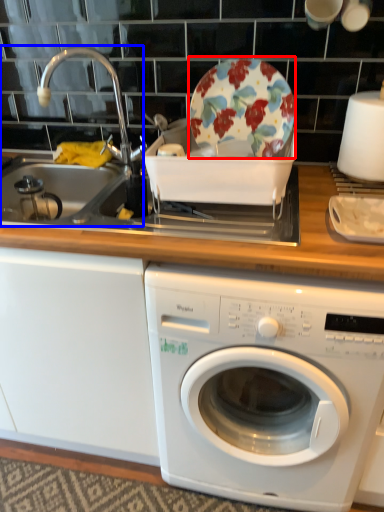
Question: Which of the following is the farthest to the observer, plate (highlighted by a red box) or sink (highlighted by a blue box)?

Choices:
 (A) plate
 (B) sink

Answer: (B)